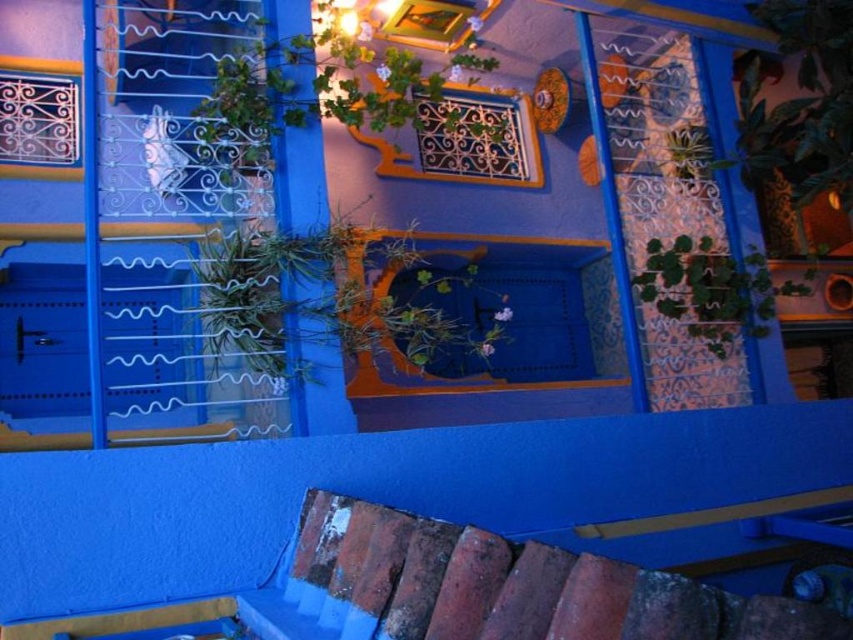
You are an interior designer planning to place a small decorative item on the windowsill. You have two plants available, the green matte plant at upper right and the green leafy plant at upper right. Which plant would you choose if you want the one that takes up more space?

The green matte plant at upper right is larger in size than the green leafy plant at upper right, so you should choose the green matte plant at upper right as it takes up more space.